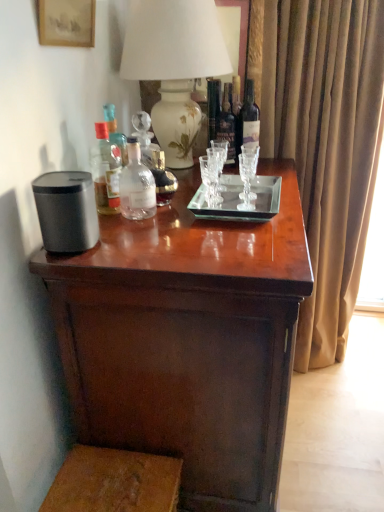
Question: Is the depth of dark glass bottle at center, marked as the 2th bottle in a right-to-left arrangement, greater than that of transparent glass tray at center?

Choices:
 (A) no
 (B) yes

Answer: (B)

Question: From the image's perspective, is dark glass bottle at center, which ranks as the fourth bottle in left-to-right order, on top of transparent glass tray at center?

Choices:
 (A) no
 (B) yes

Answer: (B)

Question: Does dark glass bottle at center, marked as the 2th bottle in a right-to-left arrangement, have a greater height compared to transparent glass tray at center?

Choices:
 (A) yes
 (B) no

Answer: (A)

Question: Would you say transparent glass tray at center is part of dark glass bottle at center, which ranks as the fourth bottle in left-to-right order,'s contents?

Choices:
 (A) yes
 (B) no

Answer: (B)

Question: Is dark glass bottle at center, which ranks as the fourth bottle in left-to-right order, not near transparent glass tray at center?

Choices:
 (A) no
 (B) yes

Answer: (A)

Question: Based on their sizes in the image, would you say translucent glass bottle at upper left, positioned as the fifth bottle in right-to-left order, is bigger or smaller than clear glass bottle at center, arranged as the fourth bottle when viewed from the right?

Choices:
 (A) big
 (B) small

Answer: (A)

Question: From a real-world perspective, relative to clear glass bottle at center, arranged as the 2th bottle when viewed from the left, is translucent glass bottle at upper left, arranged as the first bottle when viewed from the left, vertically above or below?

Choices:
 (A) below
 (B) above

Answer: (B)

Question: In the image, is translucent glass bottle at upper left, arranged as the first bottle when viewed from the left, on the left side or the right side of clear glass bottle at center, arranged as the fourth bottle when viewed from the right?

Choices:
 (A) left
 (B) right

Answer: (A)

Question: Is translucent glass bottle at upper left, positioned as the fifth bottle in right-to-left order, situated inside clear glass bottle at center, arranged as the 2th bottle when viewed from the left, or outside?

Choices:
 (A) inside
 (B) outside

Answer: (B)

Question: From the image's perspective, is wooden step stool at lower left positioned above or below dark glass bottle at center, marked as the 2th bottle in a right-to-left arrangement?

Choices:
 (A) above
 (B) below

Answer: (B)

Question: Based on their sizes in the image, would you say wooden step stool at lower left is bigger or smaller than dark glass bottle at center, which ranks as the fourth bottle in left-to-right order?

Choices:
 (A) small
 (B) big

Answer: (B)

Question: Is wooden step stool at lower left wider or thinner than dark glass bottle at center, marked as the 2th bottle in a right-to-left arrangement?

Choices:
 (A) wide
 (B) thin

Answer: (A)

Question: Does point (87, 492) appear closer or farther from the camera than point (235, 145)?

Choices:
 (A) closer
 (B) farther

Answer: (A)

Question: Looking at the image, does white ceramic vase at upper center seem bigger or smaller compared to translucent glass bottle at upper left, arranged as the first bottle when viewed from the left?

Choices:
 (A) small
 (B) big

Answer: (B)

Question: Looking at their shapes, would you say white ceramic vase at upper center is wider or thinner than translucent glass bottle at upper left, positioned as the fifth bottle in right-to-left order?

Choices:
 (A) wide
 (B) thin

Answer: (A)